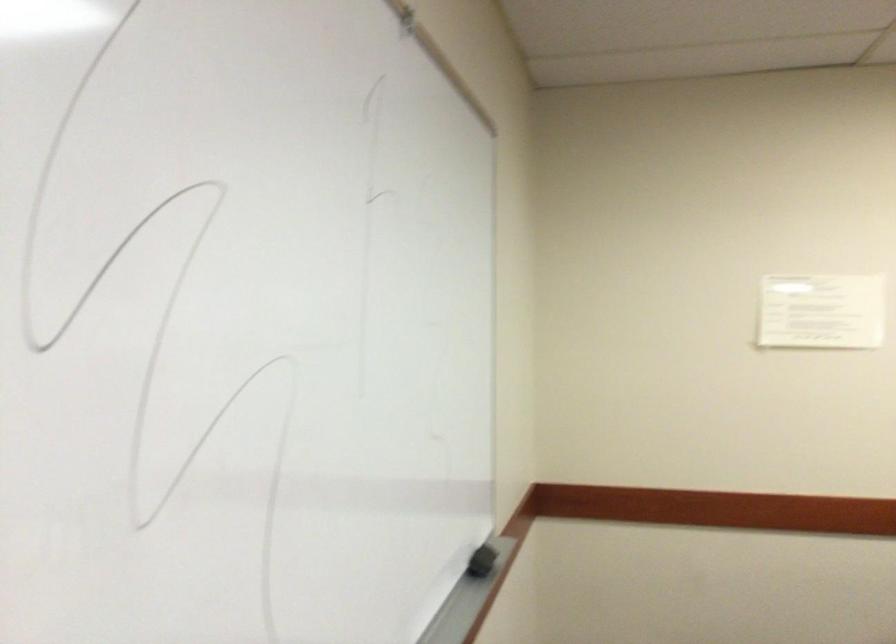
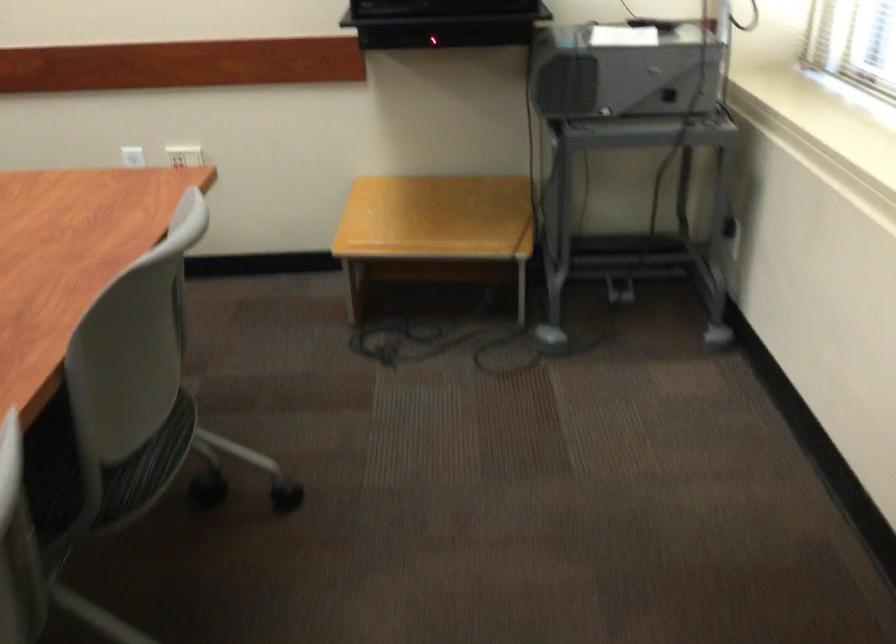
Question: The images are taken continuously from a first-person perspective. In which direction are you moving?

Choices:
 (A) Left
 (B) Right
 (C) Forward
 (D) Backward

Answer: (D)